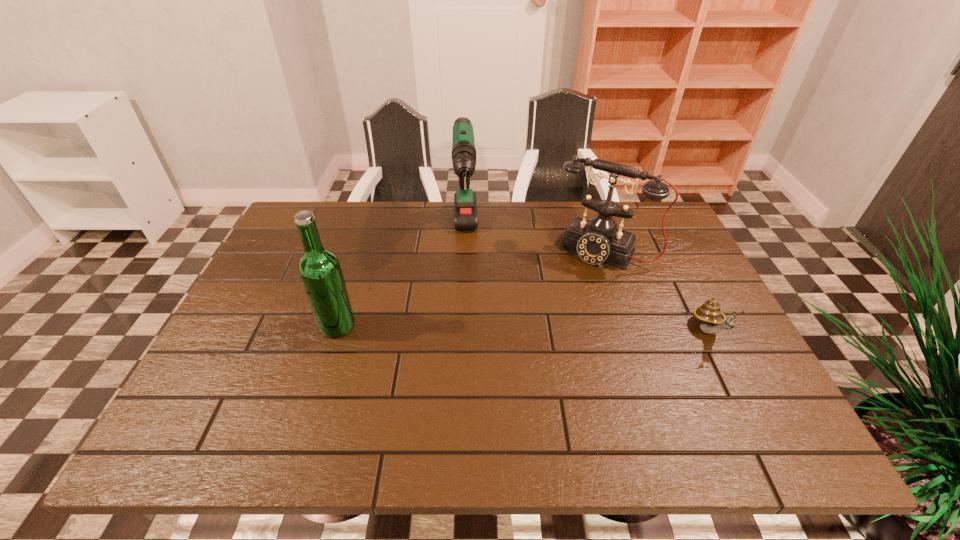
Where is `vacant spot on the desktop that is between the leftmost object and the shortest object and is positioned on the dial of the telephone`? This screenshot has width=960, height=540. vacant spot on the desktop that is between the leftmost object and the shortest object and is positioned on the dial of the telephone is located at coordinates (557, 329).

In order to click on vacant spot on the desktop that is between the beer bottle and the shortest object and is positioned on the handle side of the third object from right to left in this screenshot , I will do tap(468, 328).